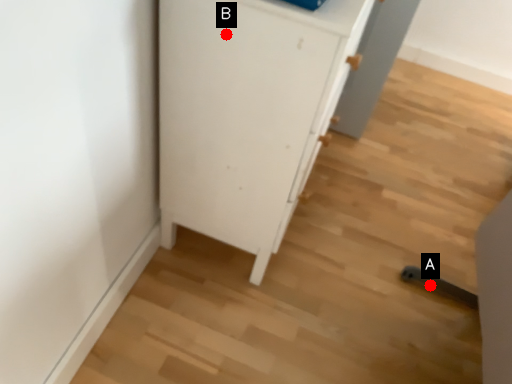
Question: Two points are circled on the image, labeled by A and B beside each circle. Among these points, which one is nearest to the camera?

Choices:
 (A) A is closer
 (B) B is closer

Answer: (B)